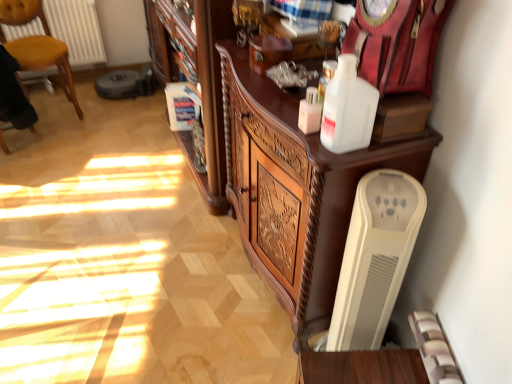
Image resolution: width=512 pixels, height=384 pixels. Describe the element at coordinates (310, 112) in the screenshot. I see `white glossy bottle at upper center, arranged as the 1th bottle when viewed from the left` at that location.

This screenshot has width=512, height=384. I want to click on white plastic radiator at upper left, so click(76, 29).

The width and height of the screenshot is (512, 384). Find the location of `white plastic bottle at upper center, positioned as the first bottle in right-to-left order`. white plastic bottle at upper center, positioned as the first bottle in right-to-left order is located at coordinates (348, 109).

Does white plastic bottle at upper center, positioned as the first bottle in right-to-left order, have a larger size compared to yellow upholstered chair at left?

No.

This screenshot has height=384, width=512. I want to click on chair lying on the left of white plastic bottle at upper center, which appears as the second bottle when viewed from the left, so click(37, 45).

From the image's perspective, which one is positioned higher, white plastic bottle at upper center, positioned as the first bottle in right-to-left order, or yellow upholstered chair at left?

From the image's view, yellow upholstered chair at left is above.

Does white plastic bottle at upper center, positioned as the first bottle in right-to-left order, contain wooden cabinet at center?

No, wooden cabinet at center is not a part of white plastic bottle at upper center, positioned as the first bottle in right-to-left order.

Find the location of a particular element. This screenshot has width=512, height=384. bottle that is the 2nd object above the wooden cabinet at center (from a real-world perspective) is located at coordinates (348, 109).

Which is nearer, (348, 147) or (382, 160)?

Clearly, point (348, 147) is closer to the camera than point (382, 160).

From their relative heights in the image, would you say white plastic bottle at upper center, which appears as the second bottle when viewed from the left, is taller or shorter than wooden cabinet at center?

In the image, white plastic bottle at upper center, which appears as the second bottle when viewed from the left, appears to be shorter than wooden cabinet at center.

Is velvet black armchair at left far from white plastic radiator at upper left?

They are positioned close to each other.

Does velvet black armchair at left have a greater width compared to white plastic radiator at upper left?

Indeed, velvet black armchair at left has a greater width compared to white plastic radiator at upper left.

Looking at this image, is velvet black armchair at left facing towards white plastic radiator at upper left?

No, velvet black armchair at left is not oriented towards white plastic radiator at upper left.

Is velvet black armchair at left taller or shorter than white plastic radiator at upper left?

velvet black armchair at left is taller than white plastic radiator at upper left.

How many degrees apart are the facing directions of white plastic heater at lower right and wooden cabinet at center?

The facing directions of white plastic heater at lower right and wooden cabinet at center are 16.6 degrees apart.

In the image, is white plastic heater at lower right positioned in front of or behind wooden cabinet at center?

white plastic heater at lower right is positioned closer to the viewer than wooden cabinet at center.

Is point (359, 252) more distant than point (310, 198)?

No, it is in front of (310, 198).

Considering the relative positions of white plastic heater at lower right and wooden cabinet at center in the image provided, is white plastic heater at lower right to the left of wooden cabinet at center from the viewer's perspective?

In fact, white plastic heater at lower right is to the right of wooden cabinet at center.

Does brown carved wood dresser at center appear on the right side of white plastic radiator at upper left?

Indeed, brown carved wood dresser at center is positioned on the right side of white plastic radiator at upper left.

Considering the relative sizes of brown carved wood dresser at center and white plastic radiator at upper left in the image provided, is brown carved wood dresser at center bigger than white plastic radiator at upper left?

Yes.

Where is `radiator below the brown carved wood dresser at center (from a real-world perspective)`? This screenshot has height=384, width=512. radiator below the brown carved wood dresser at center (from a real-world perspective) is located at coordinates (76, 29).

Can you tell me how much brown carved wood dresser at center and white plastic radiator at upper left differ in facing direction?

The angular difference between brown carved wood dresser at center and white plastic radiator at upper left is 89.6 degrees.

Is white plastic bottle at upper center, positioned as the first bottle in right-to-left order, taller or shorter than velvet black armchair at left?

Clearly, white plastic bottle at upper center, positioned as the first bottle in right-to-left order, is shorter compared to velvet black armchair at left.

You are a GUI agent. You are given a task and a screenshot of the screen. Output one action in this format:
    pyautogui.click(x=<x>, y=<y>)
    Task: Click on the armchair below the white plastic bottle at upper center, positioned as the first bottle in right-to-left order (from a real-world perspective)
    The width and height of the screenshot is (512, 384).
    Given the screenshot: What is the action you would take?
    pyautogui.click(x=13, y=95)

Is velvet black armchair at left located within white plastic bottle at upper center, which appears as the second bottle when viewed from the left?

Definitely not — velvet black armchair at left is not inside white plastic bottle at upper center, which appears as the second bottle when viewed from the left.

Is velvet black armchair at left at the back of white plastic bottle at upper center, positioned as the first bottle in right-to-left order?

white plastic bottle at upper center, positioned as the first bottle in right-to-left order, does not have its back to velvet black armchair at left.

Does point (298, 119) lie in front of point (376, 208)?

No, (298, 119) is further to viewer.

Can you confirm if white glossy bottle at upper center, arranged as the 1th bottle when viewed from the left, is positioned to the right of white plastic heater at lower right?

No.

How much distance is there between white glossy bottle at upper center, arranged as the 1th bottle when viewed from the left, and white plastic heater at lower right?

white glossy bottle at upper center, arranged as the 1th bottle when viewed from the left, and white plastic heater at lower right are 14.20 inches apart.

Is white glossy bottle at upper center, the 2th bottle in the right-to-left sequence, smaller than white plastic heater at lower right?

Indeed, white glossy bottle at upper center, the 2th bottle in the right-to-left sequence, has a smaller size compared to white plastic heater at lower right.

The image size is (512, 384). In the image, there is a white plastic bottle at upper center, positioned as the first bottle in right-to-left order. What are the coordinates of `chair below it (from a real-world perspective)` in the screenshot? It's located at (37, 45).

In the image, there is a white plastic bottle at upper center, which appears as the second bottle when viewed from the left. At what (x,y) coordinates should I click in order to perform the action: click on cabinetry below it (from the image's perspective). Please return your answer as a coordinate pair (x, y). The height and width of the screenshot is (384, 512). Looking at the image, I should click on (295, 190).

From the image, which object appears to be farther from velvet black armchair at left, white plastic heater at lower right or white glossy bottle at upper center, arranged as the 1th bottle when viewed from the left?

white plastic heater at lower right.

Estimate the real-world distances between objects in this image. Which object is closer to white plastic bottle at upper center, which appears as the second bottle when viewed from the left, wooden cabinet at center or velvet black armchair at left?

The object closer to white plastic bottle at upper center, which appears as the second bottle when viewed from the left, is wooden cabinet at center.

From the image, which object appears to be farther from white glossy bottle at upper center, arranged as the 1th bottle when viewed from the left, brown carved wood dresser at center or white plastic radiator at upper left?

white plastic radiator at upper left is positioned further to the anchor white glossy bottle at upper center, arranged as the 1th bottle when viewed from the left.

Considering their positions, is brown carved wood dresser at center positioned closer to white plastic radiator at upper left than velvet black armchair at left?

velvet black armchair at left lies closer to white plastic radiator at upper left than the other object.

Based on the photo, from the image, which object appears to be farther from white plastic heater at lower right, white plastic bottle at upper center, which appears as the second bottle when viewed from the left, or white plastic radiator at upper left?

Based on the image, white plastic radiator at upper left appears to be further to white plastic heater at lower right.

Based on their spatial positions, is white glossy bottle at upper center, arranged as the 1th bottle when viewed from the left, or white plastic radiator at upper left further from yellow upholstered chair at left?

Based on the image, white glossy bottle at upper center, arranged as the 1th bottle when viewed from the left, appears to be further to yellow upholstered chair at left.

Looking at the image, which one is located closer to yellow upholstered chair at left, white plastic radiator at upper left or wooden cabinet at center?

Among the two, white plastic radiator at upper left is located nearer to yellow upholstered chair at left.

From the image, which object appears to be farther from white plastic bottle at upper center, which appears as the second bottle when viewed from the left, white plastic heater at lower right or white plastic radiator at upper left?

white plastic radiator at upper left.

Where is `chair situated between white plastic radiator at upper left and brown carved wood dresser at center from left to right`? The image size is (512, 384). chair situated between white plastic radiator at upper left and brown carved wood dresser at center from left to right is located at coordinates (37, 45).

Find the location of `dresser between yellow upholstered chair at left and wooden cabinet at center`. dresser between yellow upholstered chair at left and wooden cabinet at center is located at coordinates (196, 76).

Find the location of a particular element. This screenshot has width=512, height=384. dresser between white plastic bottle at upper center, which appears as the second bottle when viewed from the left, and white plastic radiator at upper left, along the z-axis is located at coordinates (196, 76).

Identify the location of bottle between wooden cabinet at center and white plastic radiator at upper left from front to back. The width and height of the screenshot is (512, 384). (310, 112).